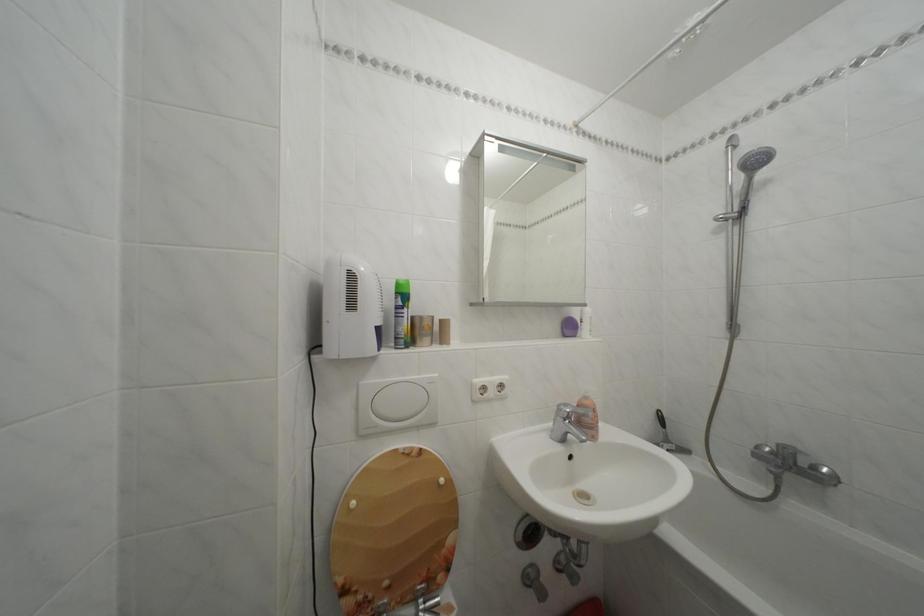
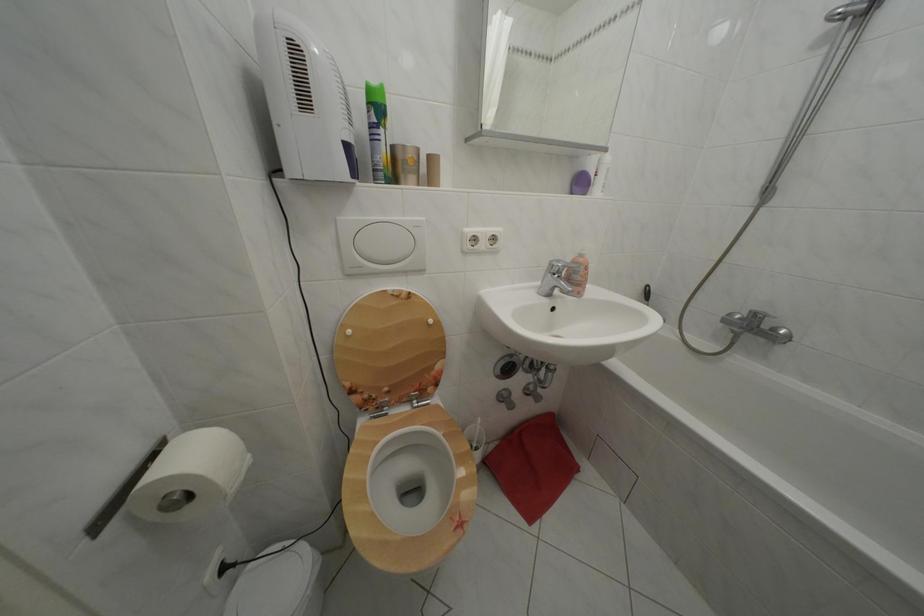
In the second image, find the point that corresponds to (362,509) in the first image.

(358, 338)